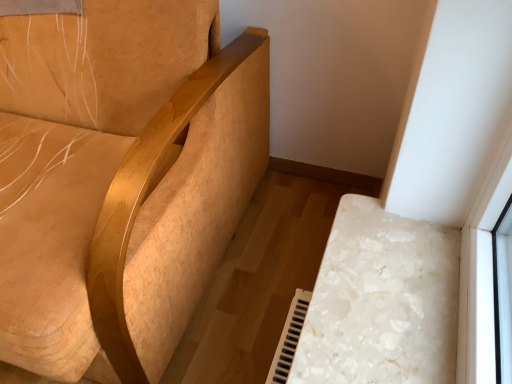
This screenshot has width=512, height=384. What do you see at coordinates (120, 179) in the screenshot?
I see `matte beige sofa at left` at bounding box center [120, 179].

Identify the location of matte beige sofa at left. (120, 179).

Find the location of a particular element. This screenshot has width=512, height=384. matte beige sofa at left is located at coordinates (120, 179).